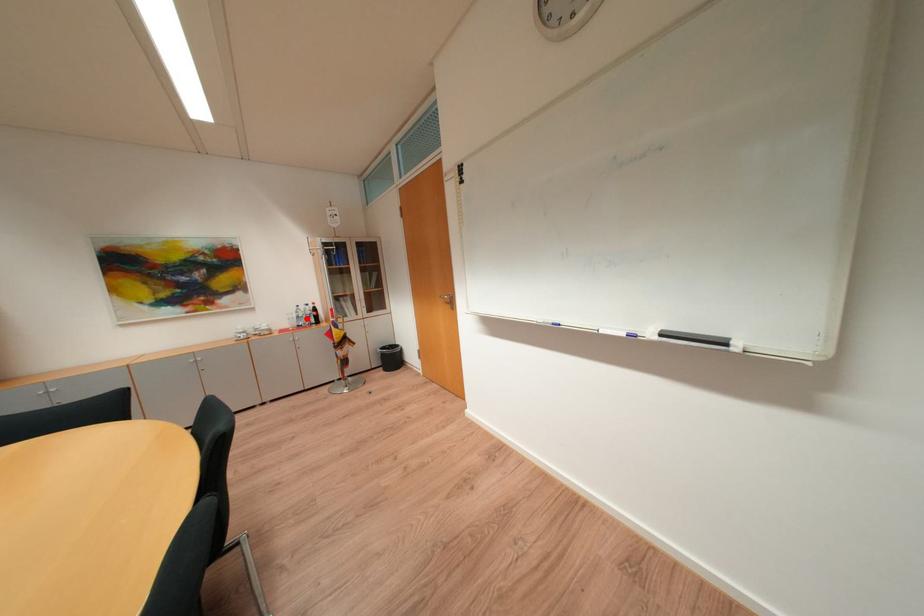
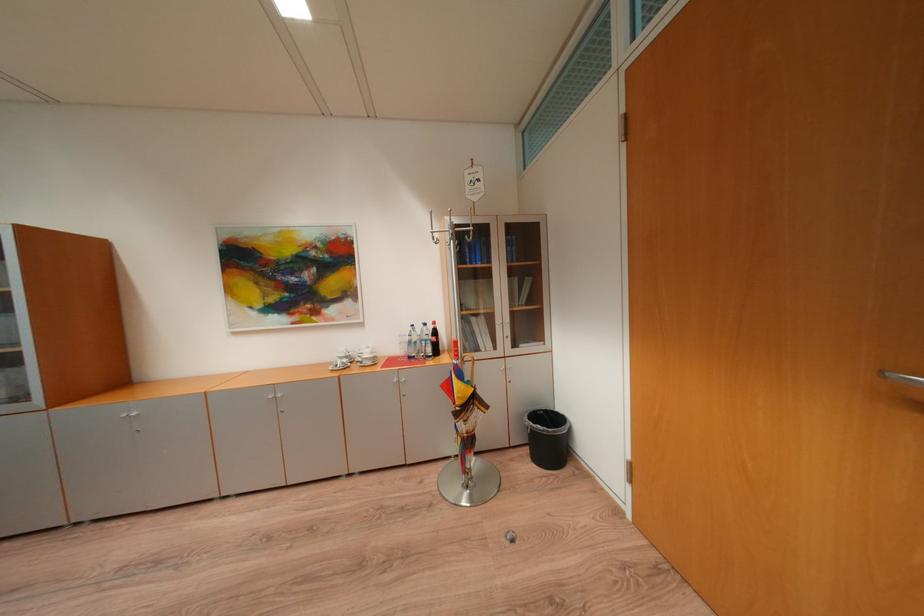
Locate, in the second image, the point that corresponds to the highlighted location in the first image.

(419, 344)